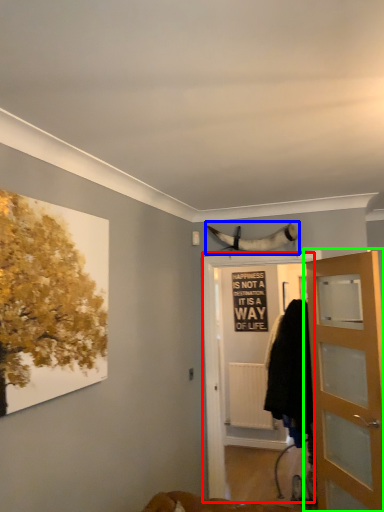
Question: Which object is positioned closest to screen door (highlighted by a red box)? Select from animal (highlighted by a blue box) and door (highlighted by a green box).

Choices:
 (A) animal
 (B) door

Answer: (A)